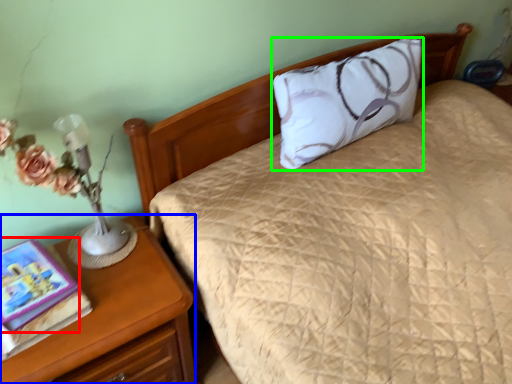
Question: Considering the real-world distances, which object is farthest from book (highlighted by a red box)? nightstand (highlighted by a blue box) or pillow (highlighted by a green box)?

Choices:
 (A) nightstand
 (B) pillow

Answer: (B)